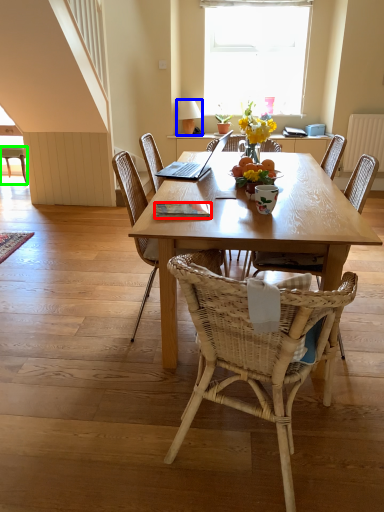
Question: Which is nearer to the book (highlighted by a red box)? lamp (highlighted by a blue box) or chair (highlighted by a green box).

Choices:
 (A) lamp
 (B) chair

Answer: (B)